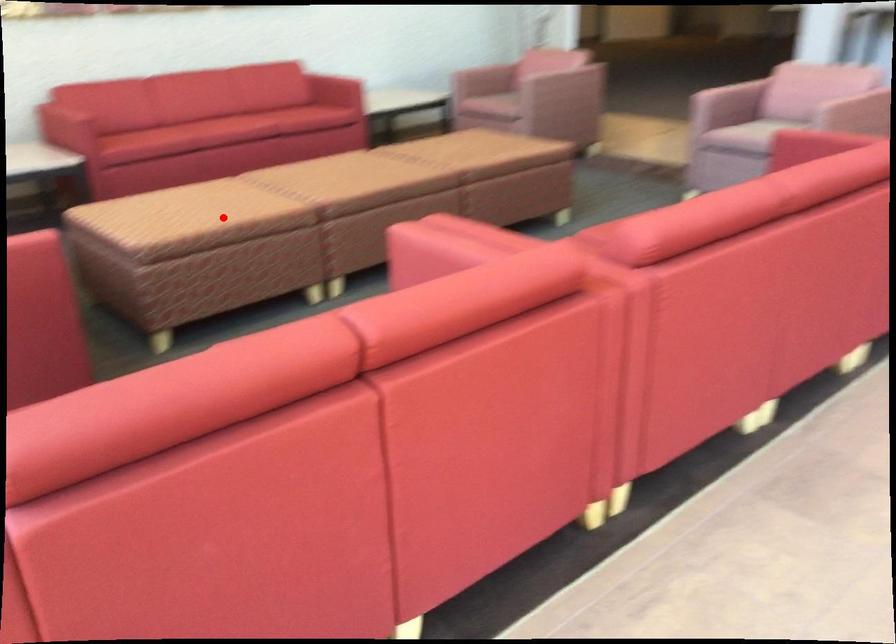
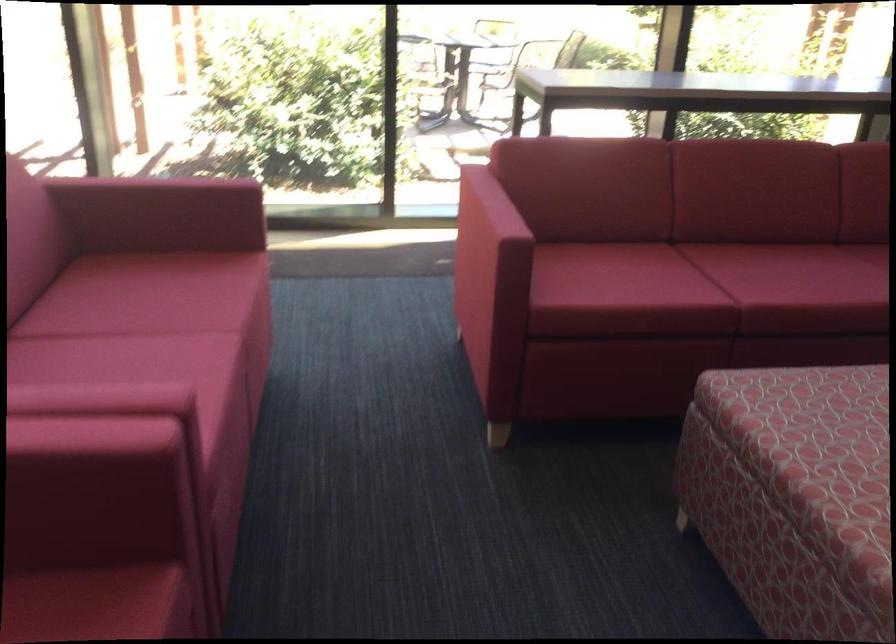
Locate, in the second image, the point that corresponds to the highlighted location in the first image.

(815, 460)